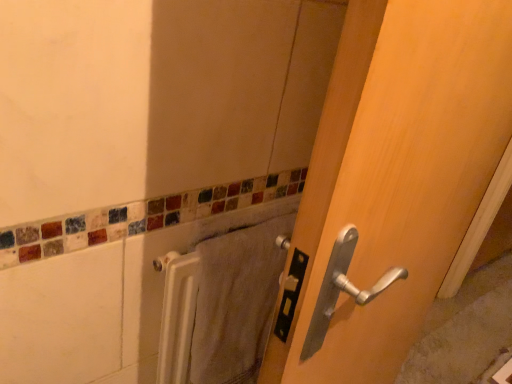
Where is `white textured towel at lower center`? The height and width of the screenshot is (384, 512). white textured towel at lower center is located at coordinates (236, 301).

Describe the element at coordinates (236, 301) in the screenshot. I see `white textured towel at lower center` at that location.

I want to click on wooden door at center, so click(x=391, y=182).

Image resolution: width=512 pixels, height=384 pixels. What do you see at coordinates (391, 182) in the screenshot?
I see `wooden door at center` at bounding box center [391, 182].

In order to face wooden door at center, should I rotate leftwards or rightwards?

Turn right approximately 19.861 degrees to face it.

Identify the location of white textured towel at lower center. The height and width of the screenshot is (384, 512). (236, 301).

In the image, is wooden door at center on the left side or the right side of white textured towel at lower center?

In the image, wooden door at center appears on the right side of white textured towel at lower center.

Considering the positions of objects wooden door at center and white textured towel at lower center in the image provided, who is behind, wooden door at center or white textured towel at lower center?

white textured towel at lower center is further from the camera.

Is point (279, 380) closer to viewer compared to point (222, 293)?

That is True.

From the image's perspective, is wooden door at center located above or below white textured towel at lower center?

wooden door at center is situated higher than white textured towel at lower center in the image.

From a real-world perspective, is wooden door at center positioned under white textured towel at lower center based on gravity?

No, from a real-world perspective, wooden door at center is not under white textured towel at lower center.

Does wooden door at center have a greater width compared to white textured towel at lower center?

Correct, the width of wooden door at center exceeds that of white textured towel at lower center.

In the scene shown: Considering the sizes of objects wooden door at center and white textured towel at lower center in the image provided, who is taller, wooden door at center or white textured towel at lower center?

wooden door at center.

Is wooden door at center bigger or smaller than white textured towel at lower center?

In the image, wooden door at center appears to be larger than white textured towel at lower center.

Is wooden door at center positioned beyond the bounds of white textured towel at lower center?

Indeed, wooden door at center is completely outside white textured towel at lower center.

Is wooden door at center positioned far away from white textured towel at lower center?

No, wooden door at center is in close proximity to white textured towel at lower center.

Is wooden door at center aimed at white textured towel at lower center?

Yes, wooden door at center is turned towards white textured towel at lower center.

How distant is wooden door at center from white textured towel at lower center?

wooden door at center is 10.03 inches from white textured towel at lower center.

The height and width of the screenshot is (384, 512). Find the location of `door that appears above the white textured towel at lower center (from the image's perspective)`. door that appears above the white textured towel at lower center (from the image's perspective) is located at coordinates click(391, 182).

Is white textured towel at lower center to the right of wooden door at center from the viewer's perspective?

In fact, white textured towel at lower center is to the left of wooden door at center.

Which object is more forward, white textured towel at lower center or wooden door at center?

wooden door at center is in front.

Is point (228, 348) behind point (386, 251)?

That is True.

From the image's perspective, which one is positioned lower, white textured towel at lower center or wooden door at center?

white textured towel at lower center is shown below in the image.

From a real-world perspective, between white textured towel at lower center and wooden door at center, who is vertically lower?

From a 3D spatial view, white textured towel at lower center is below.

Is white textured towel at lower center wider or thinner than wooden door at center?

In the image, white textured towel at lower center appears to be more narrow than wooden door at center.

Does white textured towel at lower center have a greater height compared to wooden door at center?

No, white textured towel at lower center is not taller than wooden door at center.

Is white textured towel at lower center bigger than wooden door at center?

Actually, white textured towel at lower center might be smaller than wooden door at center.

Is white textured towel at lower center not within wooden door at center?

white textured towel at lower center is positioned outside wooden door at center.

Is white textured towel at lower center far from wooden door at center?

They are positioned close to each other.

Does white textured towel at lower center turn towards wooden door at center?

Yes, white textured towel at lower center is facing wooden door at center.

Identify the location of bath towel on the left of the wooden door at center. The image size is (512, 384). (236, 301).

Locate an element on the screen. The image size is (512, 384). door on the right of the white textured towel at lower center is located at coordinates (391, 182).

You are a GUI agent. You are given a task and a screenshot of the screen. Output one action in this format:
    pyautogui.click(x=<x>, y=<y>)
    Task: Click on the bath towel on the left of wooden door at center
    The height and width of the screenshot is (384, 512).
    Given the screenshot: What is the action you would take?
    pyautogui.click(x=236, y=301)